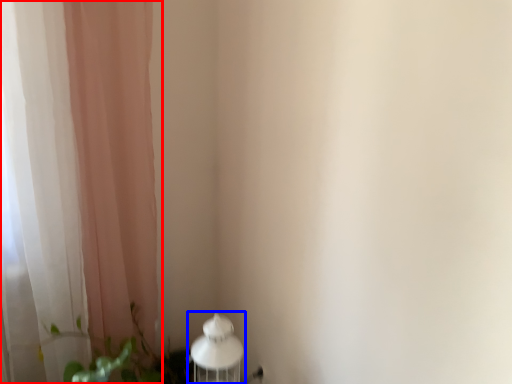
Question: Which of the following is the farthest to the observer, curtain (highlighted by a red box) or table lamp (highlighted by a blue box)?

Choices:
 (A) curtain
 (B) table lamp

Answer: (B)